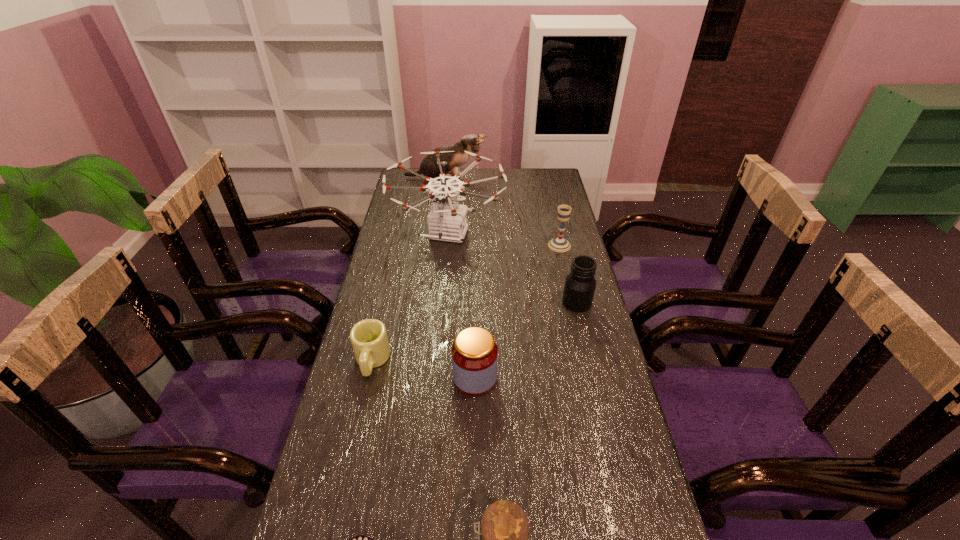
Locate which object is the third closest to the chalice. Please provide its 2D coordinates. Your answer should be formatted as a tuple, i.e. [(x, y)], where the tuple contains the x and y coordinates of a point satisfying the conditions above.

[(471, 143)]

This screenshot has height=540, width=960. Find the location of `the closest jar to the farthest object`. the closest jar to the farthest object is located at coordinates 580,284.

Image resolution: width=960 pixels, height=540 pixels. Find the location of `jar that is the second closest to the second farthest jar`. jar that is the second closest to the second farthest jar is located at coordinates tap(502, 539).

At what (x,y) coordinates should I click in order to perform the action: click on vacant space that satisfies the following two spatial constraints: 1. at the face of the drone; 2. on the right side of the farthest object. Please return your answer as a coordinate pair (x, y). Looking at the image, I should click on (439, 234).

At what (x,y) coordinates should I click in order to perform the action: click on vacant space that satisfies the following two spatial constraints: 1. at the face of the farthest object; 2. on the back side of the second nearest jar. Please return your answer as a coordinate pair (x, y). Looking at the image, I should click on click(x=421, y=378).

The height and width of the screenshot is (540, 960). Find the location of `free space that satisfies the following two spatial constraints: 1. at the face of the second tallest object; 2. on the left side of the second farthest jar`. free space that satisfies the following two spatial constraints: 1. at the face of the second tallest object; 2. on the left side of the second farthest jar is located at coordinates (421, 378).